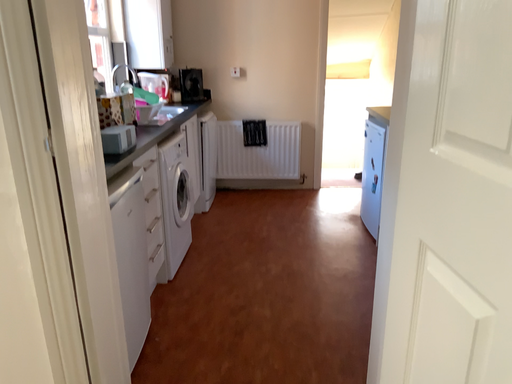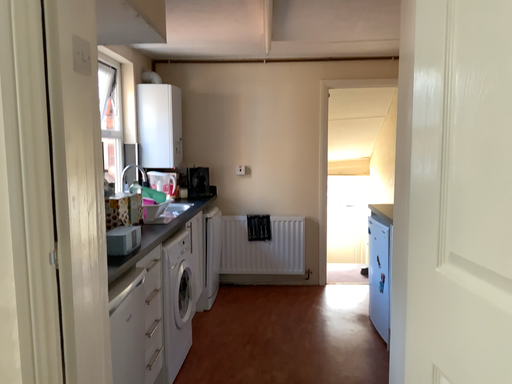
Question: Which way did the camera rotate in the video?

Choices:
 (A) rotated upward
 (B) rotated downward

Answer: (A)